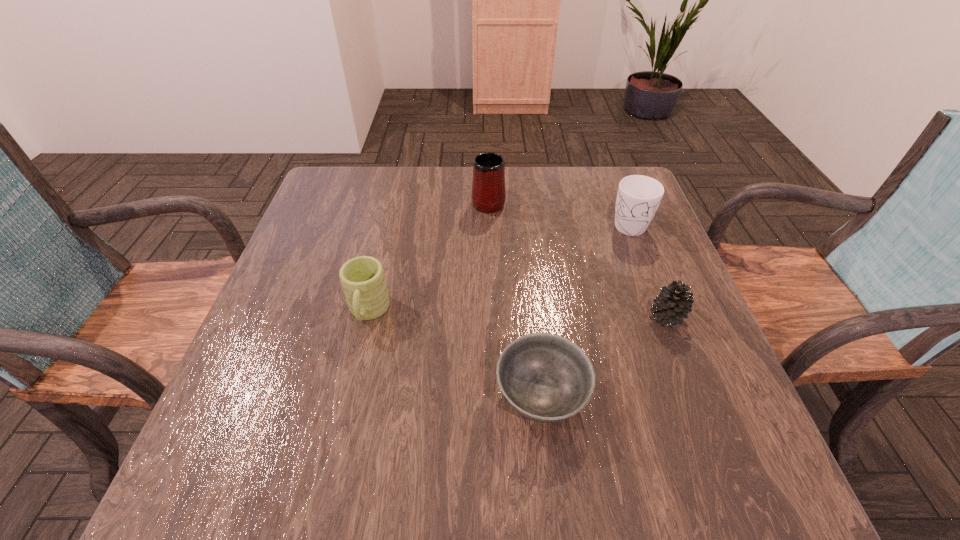
Image resolution: width=960 pixels, height=540 pixels. Find the location of `free space at the far left corner of the desktop`. free space at the far left corner of the desktop is located at coordinates (347, 199).

Identify the location of free spot at the near left corner of the desktop. (274, 446).

The height and width of the screenshot is (540, 960). In order to click on blank space at the far right corner of the desktop in this screenshot , I will do tap(615, 171).

In order to click on empty space that is in between the nearest object and the rightmost mug in this screenshot , I will do `click(585, 309)`.

This screenshot has width=960, height=540. In order to click on empty location between the rightmost mug and the nearest object in this screenshot , I will do (x=585, y=309).

The width and height of the screenshot is (960, 540). I want to click on free space between the leftmost mug and the rightmost mug, so click(x=498, y=267).

The height and width of the screenshot is (540, 960). Identify the location of vacant space that's between the rightmost mug and the leftmost mug. (498, 267).

Find the location of `free space that is in between the leftmost mug and the bowl`. free space that is in between the leftmost mug and the bowl is located at coordinates (455, 354).

Locate an element on the screen. vacant point located between the leftmost object and the rightmost mug is located at coordinates (498, 267).

The width and height of the screenshot is (960, 540). In order to click on empty location between the shortest mug and the rightmost mug in this screenshot , I will do `click(498, 267)`.